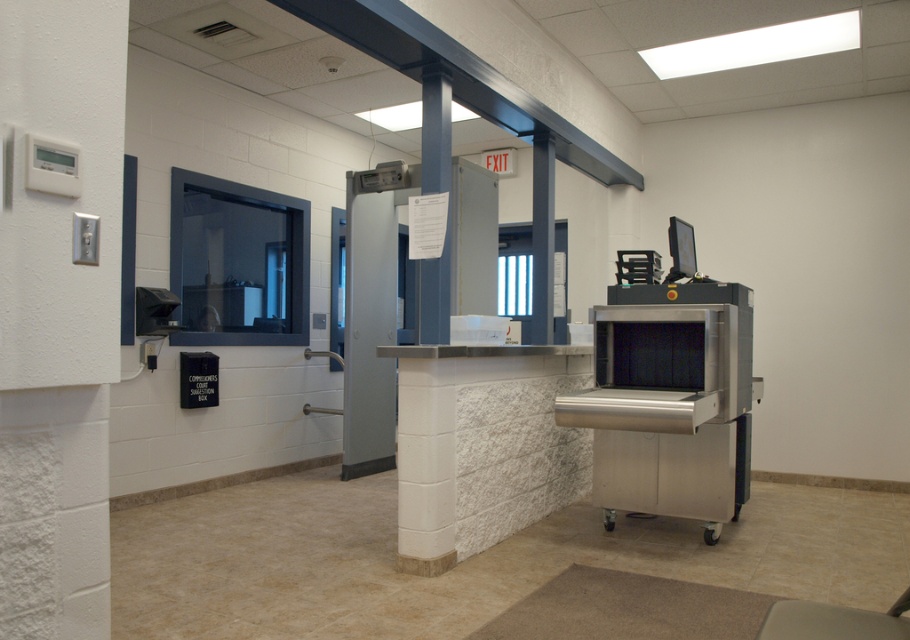
Question: Estimate the real-world distances between objects in this image. Which object is closer to the smooth gray stool at lower right?

Choices:
 (A) gray metallic door at center
 (B) white textured wall at left

Answer: (B)

Question: Does white textured wall at left appear on the right side of metallic gray pillar at center?

Choices:
 (A) yes
 (B) no

Answer: (B)

Question: Which of these objects is positioned closest to the white textured wall at left?

Choices:
 (A) gray metallic door at center
 (B) blue glossy pillar at center

Answer: (B)

Question: Among these objects, which one is nearest to the camera?

Choices:
 (A) blue glossy pillar at center
 (B) metallic gray pillar at center
 (C) white textured wall at left
 (D) stainless steel oven at center

Answer: (C)

Question: Where is white textured wall at left located in relation to gray metallic door at center in the image?

Choices:
 (A) right
 (B) left

Answer: (B)

Question: Is stainless steel oven at center thinner than gray metallic door at center?

Choices:
 (A) no
 (B) yes

Answer: (A)